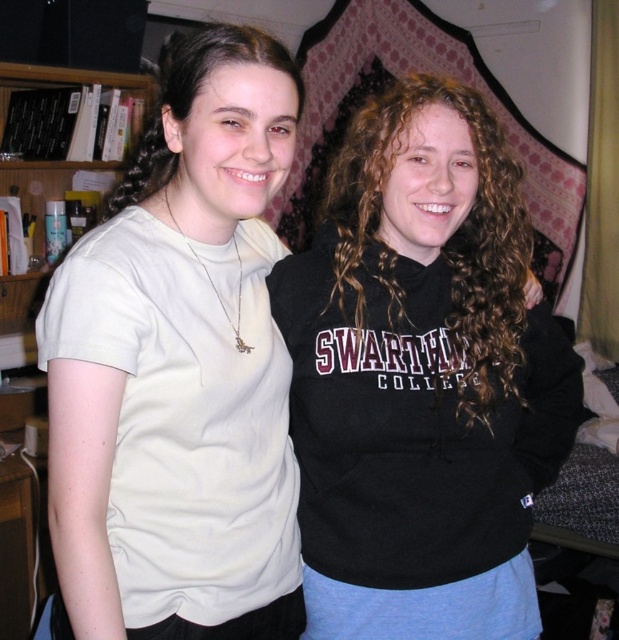
You are standing in the image and want to hand a gift to the person wearing the black matte hoodie at right. To do so, where should you walk to in relation to the other person in the scene?

You should walk to the right side of the scene, near the location of the black matte hoodie at right, which is at point 0.592 on the x and 0.682 on the y axis.

You are standing in the room and want to hand the black matte hoodie at right to someone. Where should you go to pick it up?

The black matte hoodie at right is located at point (x=422, y=378), so you should go to that coordinate to pick it up.